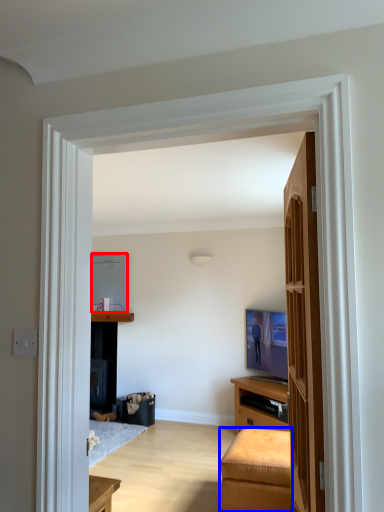
Question: Which object appears closest to the camera in this image, appliance (highlighted by a red box) or furniture (highlighted by a blue box)?

Choices:
 (A) appliance
 (B) furniture

Answer: (B)